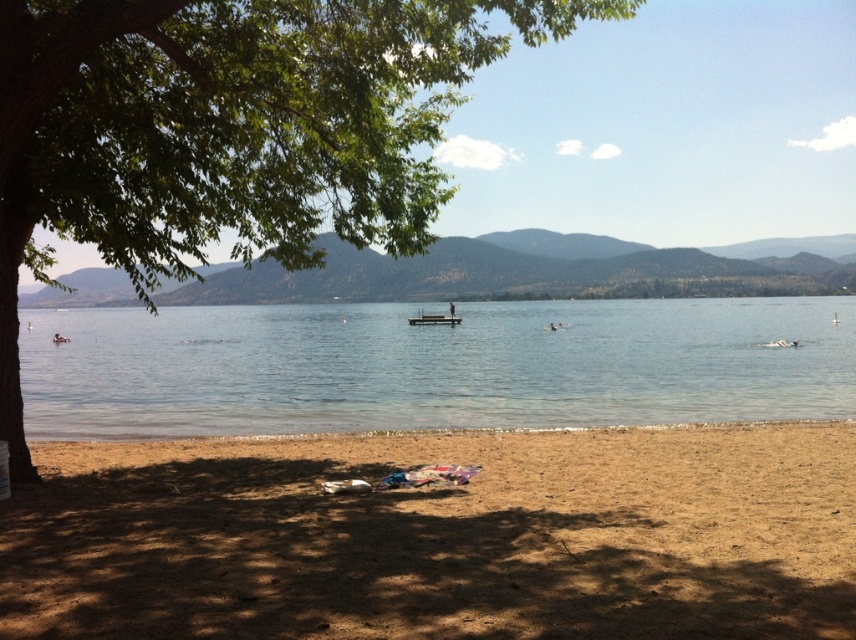
You are planning to take a photo of the wooden dock at center and the clear blue water at center from the lakeside. Which object should you place on the left side of your camera frame to ensure both are visible?

You should place the wooden dock at center on the left side of your camera frame because the clear blue water at center is positioned on the right side of the wooden dock at center, so positioning the dock to the left will allow both objects to be visible in the frame.

You are planning to set up a picnic area in this lakeside scene. Considering the green leafy tree at lower left and the clear blue water at center, which object would provide more shade for your picnic setup?

The green leafy tree at lower left is larger in size than the clear blue water at center, so it would provide more shade for the picnic setup.

You are planning to set up a picnic area near the lake. You have a picnic basket and need to decide where to place it. Considering the green leafy tree at lower left and the clear blue water at center, which object is closer to the left side of the image?

The green leafy tree at lower left is closer to the left side of the image as it is positioned to the left of the clear blue water at center.